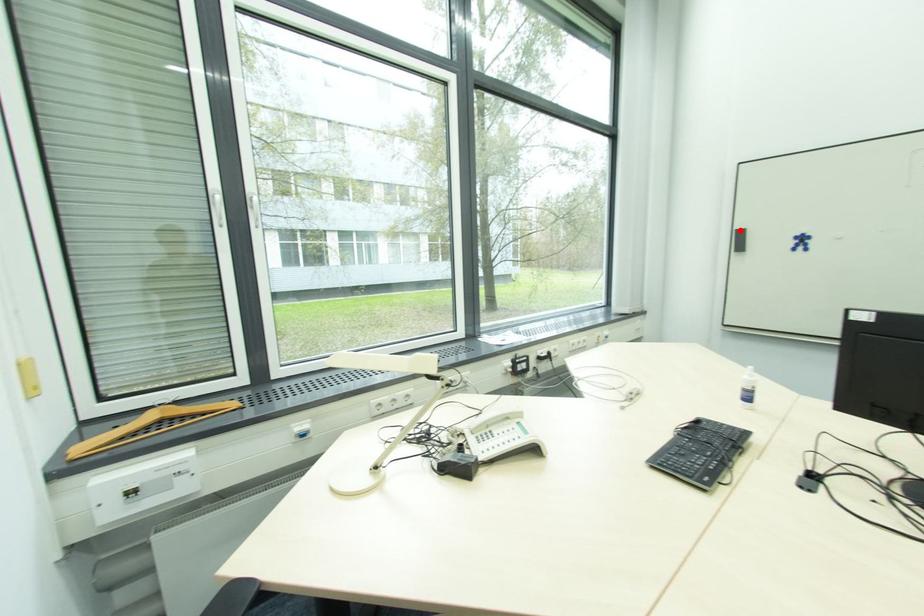
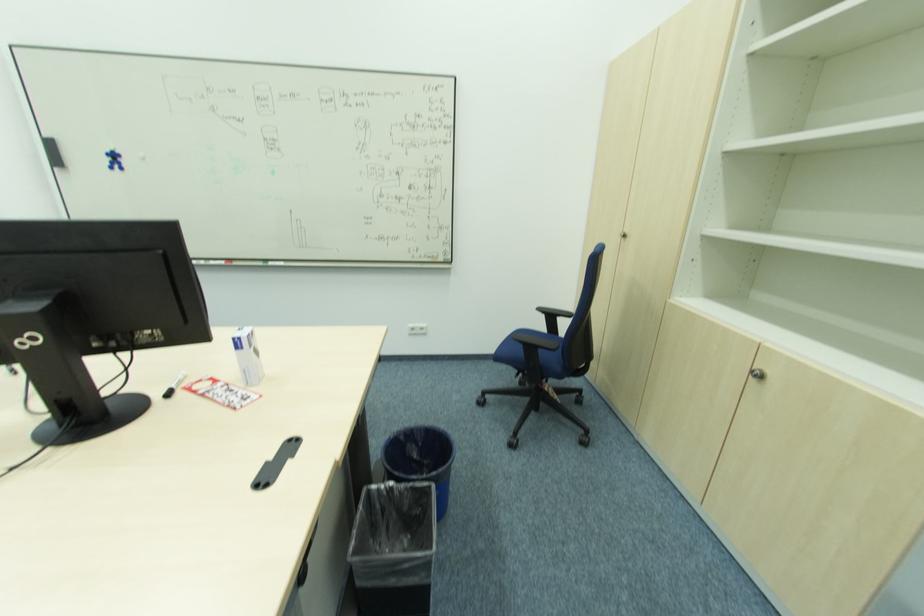
The point at the highlighted location is marked in the first image. Where is the corresponding point in the second image?

(52, 140)